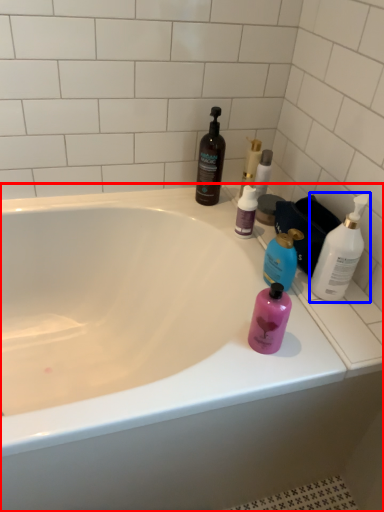
Question: Which object is closer to the camera taking this photo, bathtub (highlighted by a red box) or bottle (highlighted by a blue box)?

Choices:
 (A) bathtub
 (B) bottle

Answer: (A)